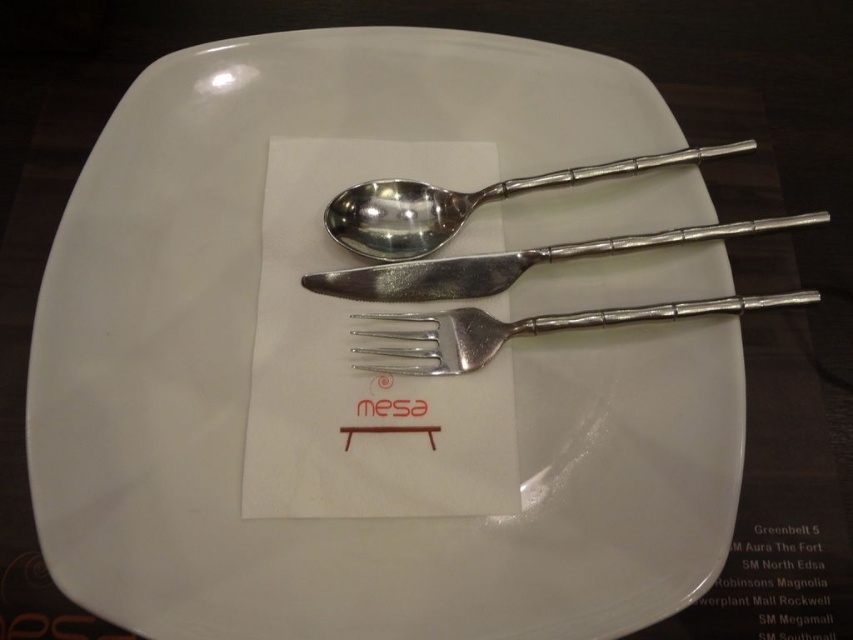
Question: Which point is closer to the camera?

Choices:
 (A) (474, 333)
 (B) (505, 288)
 (C) (369, 257)

Answer: (A)

Question: Considering the real-world distances, which object is closest to the polished silver knife at center?

Choices:
 (A) polished metal spoon at center
 (B) silver metallic fork at center

Answer: (B)

Question: Estimate the real-world distances between objects in this image. Which object is farther from the polished silver knife at center?

Choices:
 (A) silver metallic fork at center
 (B) polished metal spoon at center

Answer: (B)

Question: Is polished silver knife at center to the right of silver metallic fork at center from the viewer's perspective?

Choices:
 (A) yes
 (B) no

Answer: (B)

Question: Is polished metal spoon at center below polished silver knife at center?

Choices:
 (A) no
 (B) yes

Answer: (A)

Question: Can you confirm if polished metal spoon at center is smaller than polished silver knife at center?

Choices:
 (A) no
 (B) yes

Answer: (A)